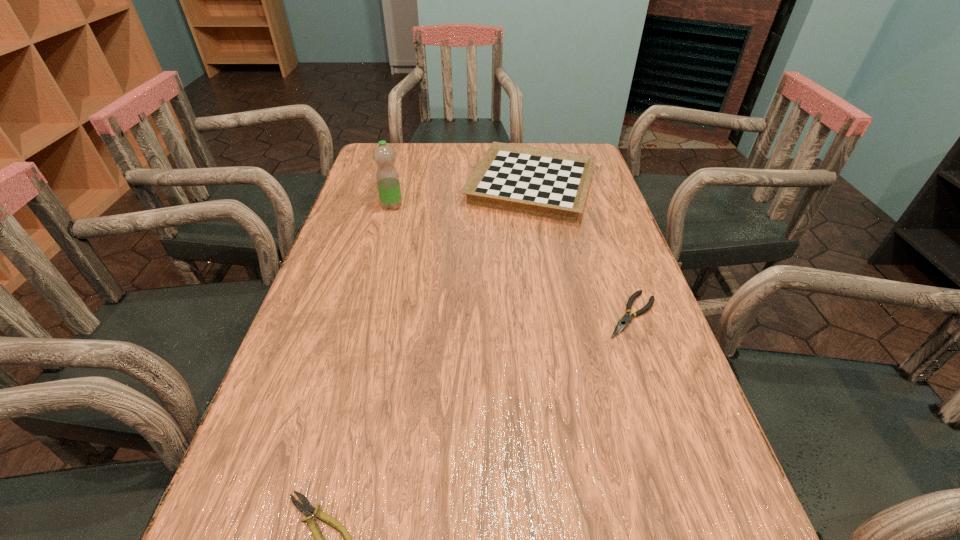
You are a GUI agent. You are given a task and a screenshot of the screen. Output one action in this format:
    pyautogui.click(x=<x>, y=<y>)
    Task: Click on the object that ranks as the second closest to the water bottle
    
    Given the screenshot: What is the action you would take?
    pyautogui.click(x=623, y=322)

This screenshot has width=960, height=540. Find the location of `object that is the third closest one to the water bottle`. object that is the third closest one to the water bottle is located at coordinates (306, 507).

The image size is (960, 540). I want to click on free point that satisfies the following two spatial constraints: 1. on the front side of the water bottle; 2. on the right side of the farther pliers, so click(x=363, y=315).

Identify the location of vacant region that satisfies the following two spatial constraints: 1. on the front side of the water bottle; 2. on the right side of the third tallest object. (363, 315).

Where is `vacant space that satisfies the following two spatial constraints: 1. on the front side of the taller pliers; 2. on the left side of the water bottle`? vacant space that satisfies the following two spatial constraints: 1. on the front side of the taller pliers; 2. on the left side of the water bottle is located at coordinates point(363,315).